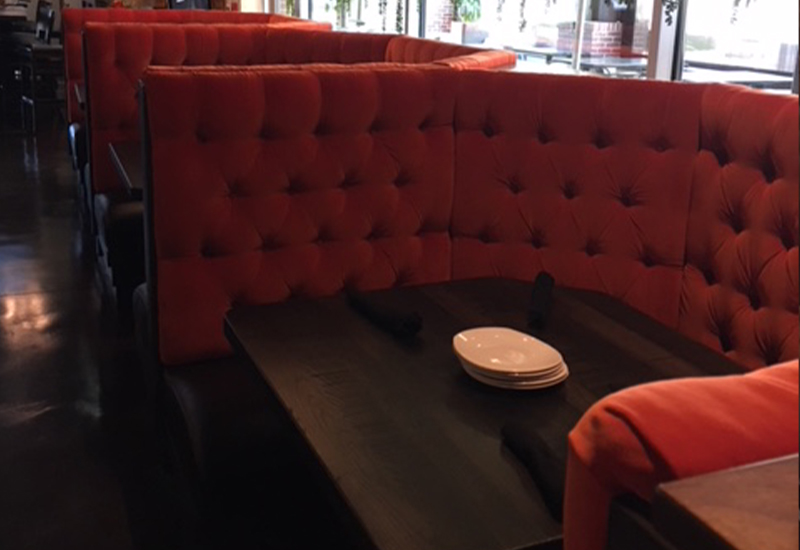
Identify the location of black napkins. (388, 320), (536, 456), (542, 308).